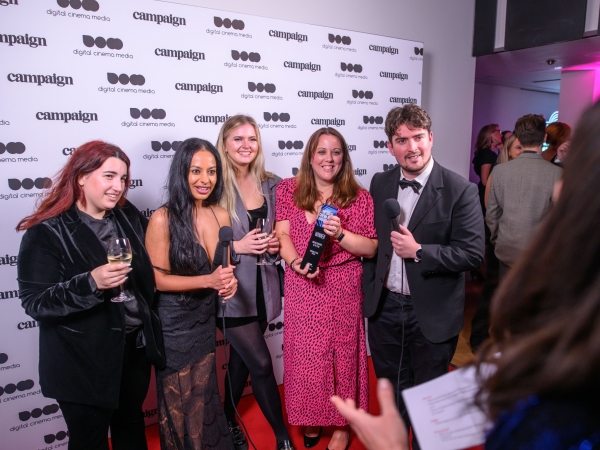
You are a GUI agent. You are given a task and a screenshot of the screen. Output one action in this format:
    pyautogui.click(x=<x>, y=<y>)
    Task: Click on the poster background
    The image size is (600, 450).
    Given the screenshot: What is the action you would take?
    pyautogui.click(x=173, y=136)